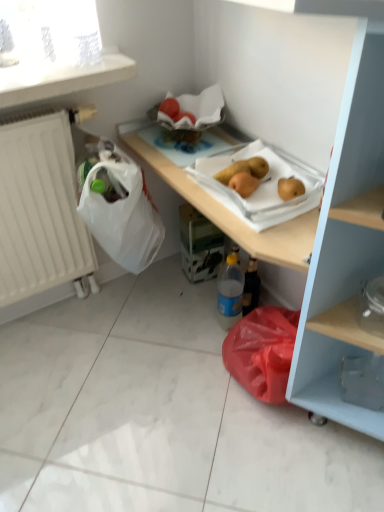
The image size is (384, 512). I want to click on vacant space situated on the left part of blue plastic bottle at lower center, so click(186, 325).